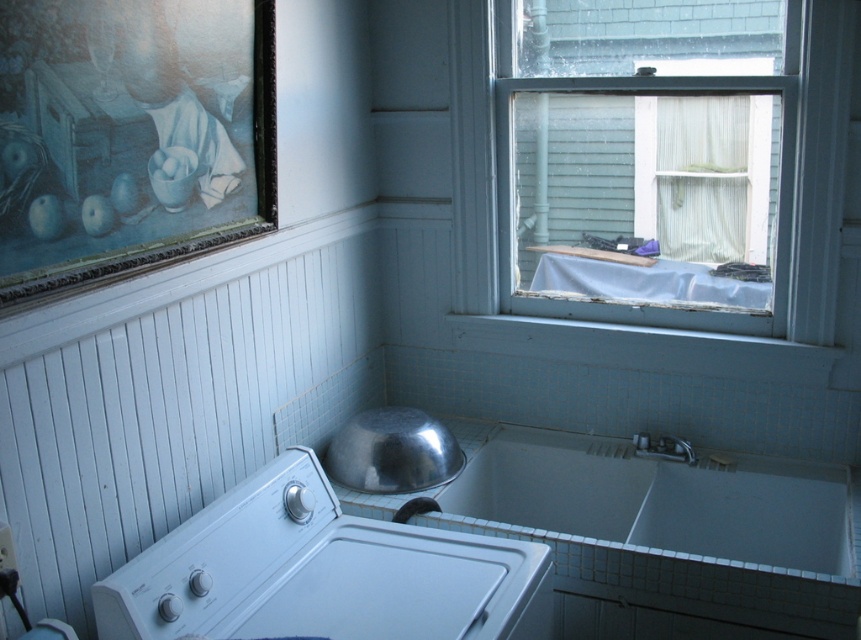
Is clear glass window at upper right bigger than white plastic washer at lower left?

Yes.

Who is positioned more to the right, clear glass window at upper right or white plastic washer at lower left?

clear glass window at upper right is more to the right.

At what (x,y) coordinates should I click in order to perform the action: click on clear glass window at upper right. Please return your answer as a coordinate pair (x, y). Looking at the image, I should click on (654, 157).